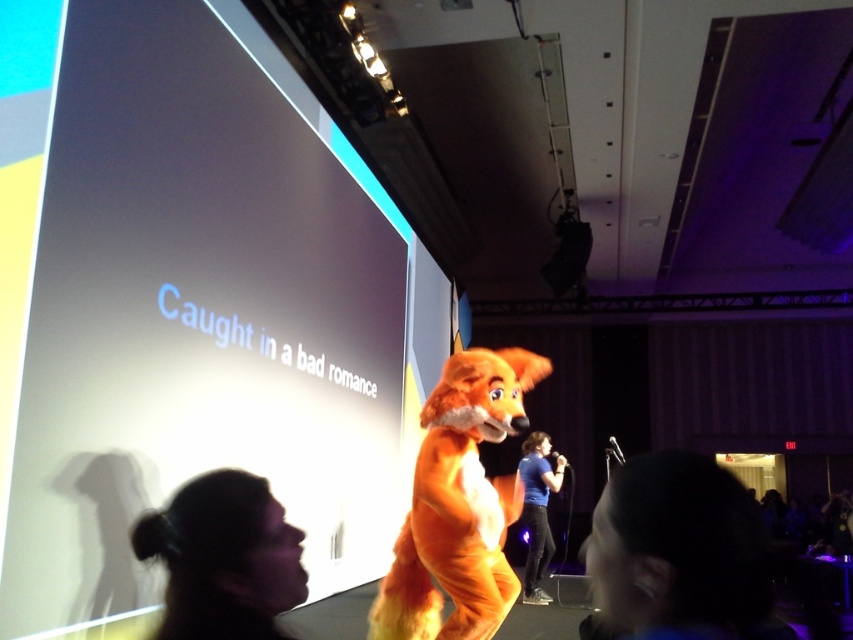
Question: Among these objects, which one is nearest to the camera?

Choices:
 (A) silky black hair at lower left
 (B) orange furry fox at center

Answer: (A)

Question: Which point is farther from the camera taking this photo?

Choices:
 (A) (502, 616)
 (B) (285, 576)
 (C) (538, 474)
 (D) (636, 461)

Answer: (C)

Question: Among these points, which one is nearest to the camera?

Choices:
 (A) (650, 476)
 (B) (544, 516)
 (C) (149, 528)
 (D) (432, 529)

Answer: (A)

Question: Does orange furry fox at center have a lesser width compared to silky black hair at lower left?

Choices:
 (A) no
 (B) yes

Answer: (A)

Question: Can you confirm if dark hair at lower right is positioned to the right of orange furry fox at center?

Choices:
 (A) no
 (B) yes

Answer: (B)

Question: Observing the image, what is the correct spatial positioning of dark hair at lower right in reference to orange furry fox at center?

Choices:
 (A) left
 (B) right

Answer: (B)